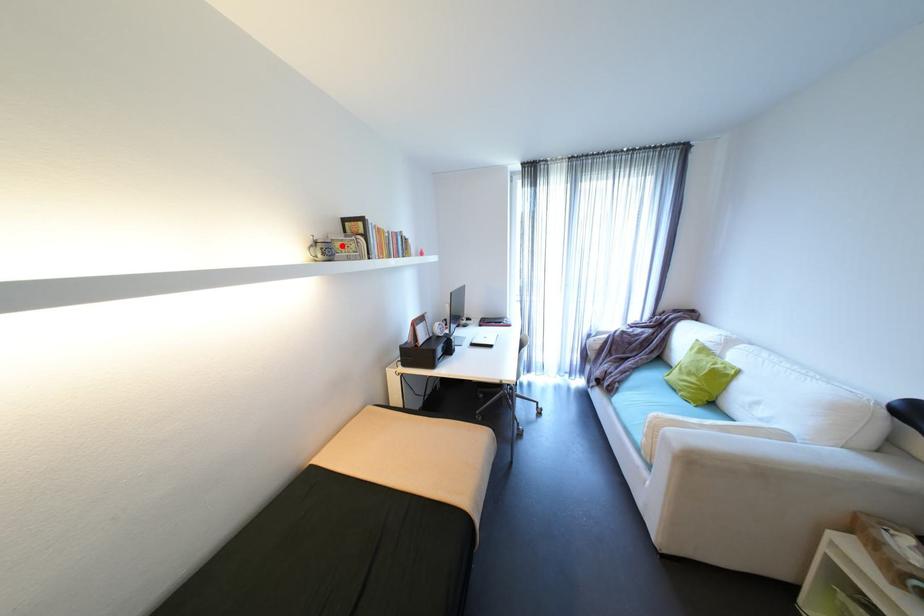
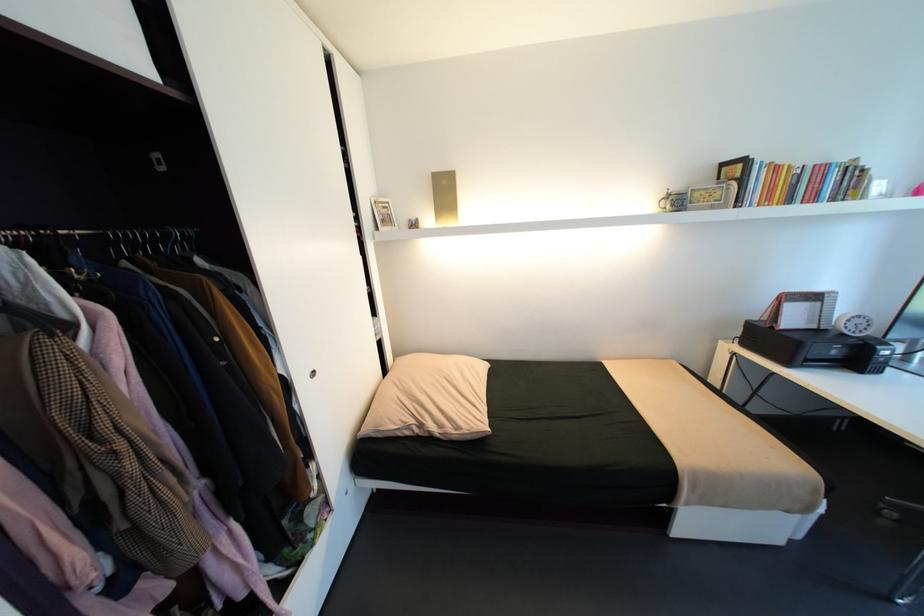
Locate, in the second image, the point that corresponds to the highlighted location in the first image.

(700, 196)